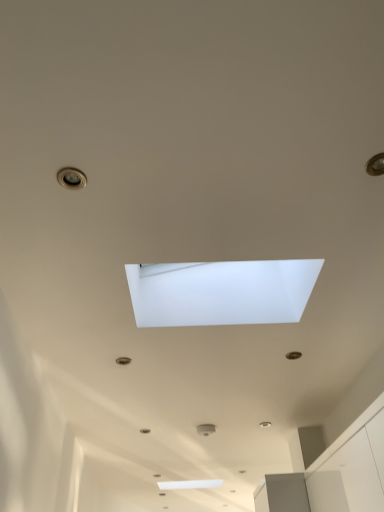
This screenshot has height=512, width=384. What are the coordinates of `white matte window at center` in the screenshot? It's located at (221, 292).

The height and width of the screenshot is (512, 384). Describe the element at coordinates (221, 292) in the screenshot. I see `white matte window at center` at that location.

The height and width of the screenshot is (512, 384). In order to click on white matte window at center in this screenshot , I will do `click(221, 292)`.